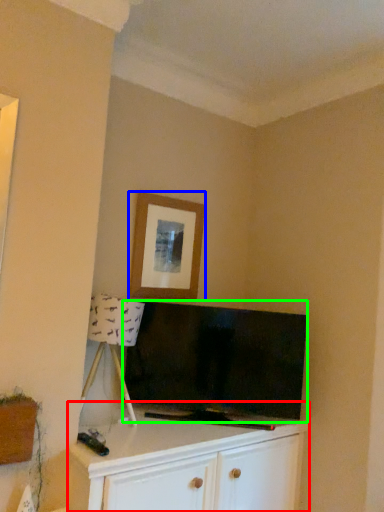
Question: Based on their relative distances, which object is farther from cabinetry (highlighted by a red box)? Choose from picture frame (highlighted by a blue box) and television (highlighted by a green box).

Choices:
 (A) picture frame
 (B) television

Answer: (A)